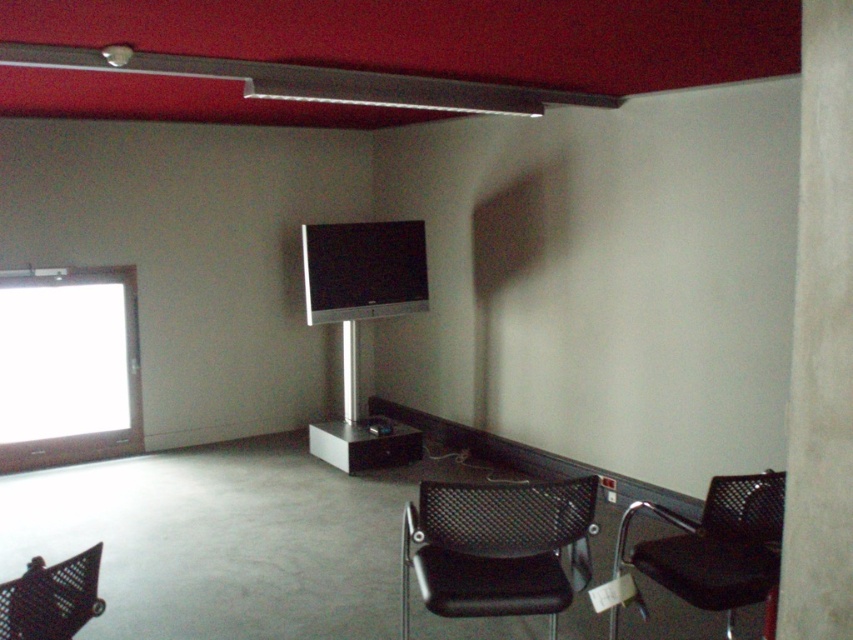
You are a delivery person trying to place a new coffee table between the black mesh chair at lower center and the black mesh swivel chair at lower left. The coffee table is 3 feet wide. Can you fit it between them?

The black mesh chair at lower center and black mesh swivel chair at lower left are 3.94 feet apart, so yes, the coffee table that is 3 feet wide can fit between them since there is enough space.

You are sitting in the black mesh swivel chair at lower left and want to move to the black mesh chair at lower center. Which direction should you move to reach it?

The black mesh chair at lower center is to the right of the black mesh swivel chair at lower left, so you should move to the right to reach it.

From the picture: You are sitting in the black mesh chair at lower center and want to look at the satin black flat screen at center. In which direction should you turn your head?

You should turn your head to the left because the black mesh chair at lower center is to the right of the satin black flat screen at center, so looking left will face the screen.